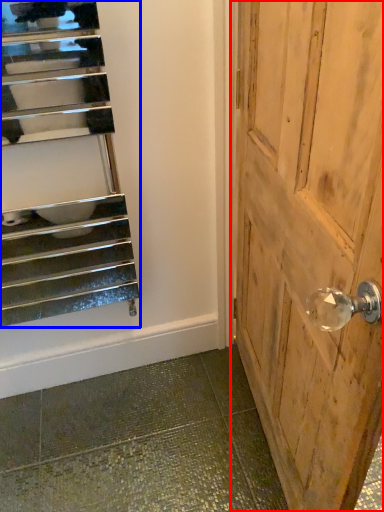
Question: Among these objects, which one is farthest to the camera, door (highlighted by a red box) or stairs (highlighted by a blue box)?

Choices:
 (A) door
 (B) stairs

Answer: (B)